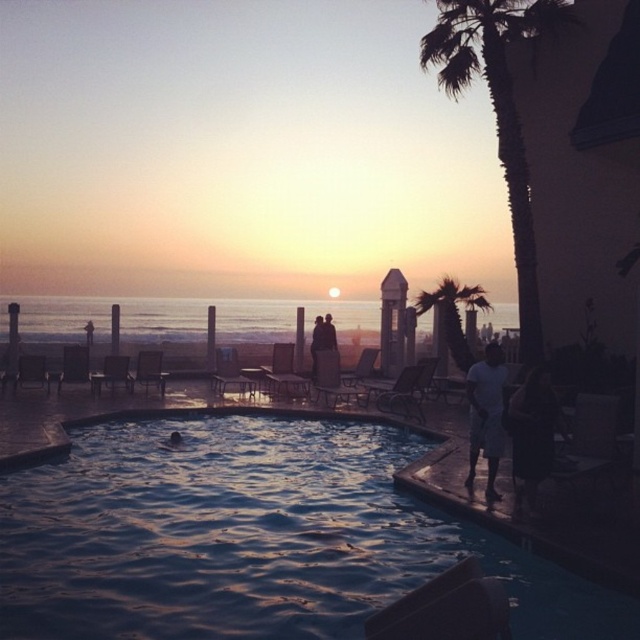
Question: Is white cotton shorts at lower right positioned behind green leafy palm tree at upper right?

Choices:
 (A) no
 (B) yes

Answer: (A)

Question: Can you confirm if shiny blue water at center is positioned above green leafy palm tree at right?

Choices:
 (A) no
 (B) yes

Answer: (A)

Question: Estimate the real-world distances between objects in this image. Which object is farther from the shiny blue water at center?

Choices:
 (A) green leafy palm tree at right
 (B) green leafy palm tree at upper right

Answer: (A)

Question: Can you confirm if green leafy palm tree at right is positioned above smooth dark hair at center?

Choices:
 (A) no
 (B) yes

Answer: (B)

Question: Which is nearer to the smooth dark hair at center?

Choices:
 (A) green leafy palm tree at right
 (B) white cotton shorts at lower right
 (C) dark fabric bag at lower right

Answer: (A)

Question: Which point is closer to the camera taking this photo?

Choices:
 (A) (369, 579)
 (B) (435, 296)
 (C) (488, 413)
 (D) (552, 452)

Answer: (A)